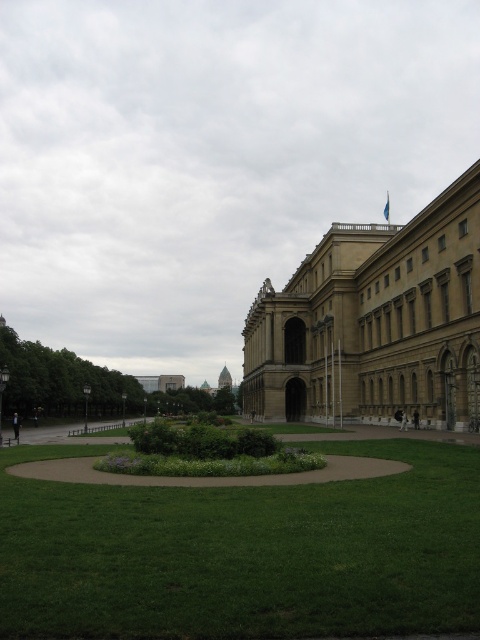
Who is taller, green grass at center or brown stone building at center?

brown stone building at center is taller.

Does green grass at center appear under brown stone building at center?

Yes.

Locate an element on the screen. This screenshot has height=640, width=480. green grass at center is located at coordinates (244, 552).

You are a GUI agent. You are given a task and a screenshot of the screen. Output one action in this format:
    pyautogui.click(x=<x>, y=<y>)
    Task: Click on the green grass at center
    The height and width of the screenshot is (640, 480).
    Given the screenshot: What is the action you would take?
    pyautogui.click(x=244, y=552)